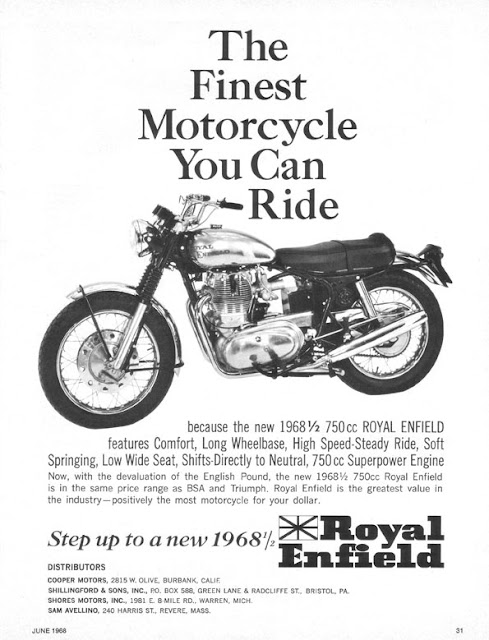
Find the location of `seat`. seat is located at coordinates (367, 257).